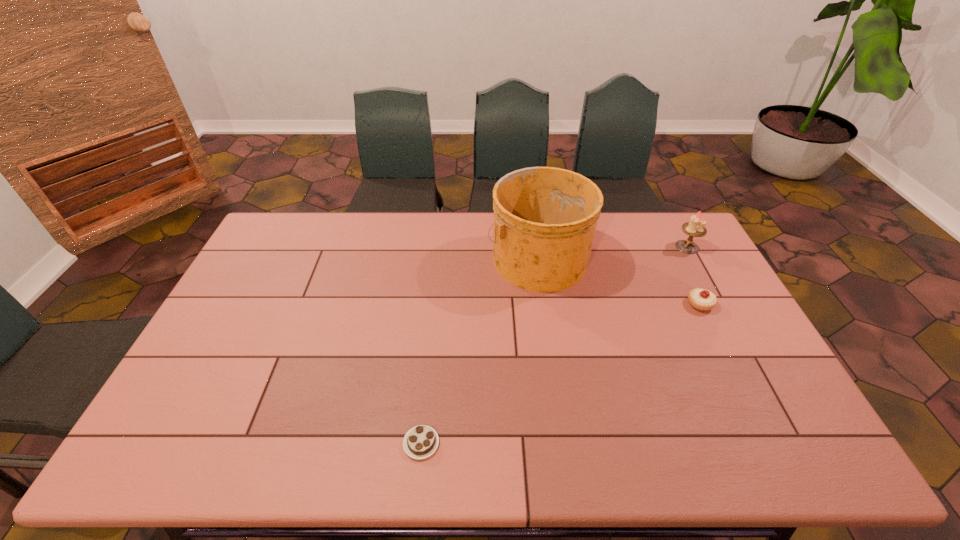
The image size is (960, 540). What are the coordinates of `free space that is in between the tallest object and the third tallest object` in the screenshot? It's located at pos(619,281).

This screenshot has width=960, height=540. I want to click on vacant region between the chocolate cake and the pastry, so click(x=561, y=374).

Where is `free point between the leftmost object and the second tallest object`? The height and width of the screenshot is (540, 960). free point between the leftmost object and the second tallest object is located at coordinates (554, 345).

This screenshot has width=960, height=540. Identify the location of vacant point located between the chocolate cake and the second shortest object. (561, 374).

In order to click on object that stands as the third closest to the tallest object in this screenshot , I will do `click(420, 442)`.

Locate an element on the screen. the second closest object to the candle holder is located at coordinates (545, 218).

You are a GUI agent. You are given a task and a screenshot of the screen. Output one action in this format:
    pyautogui.click(x=<x>, y=<y>)
    Task: Click on the blank space that satisfies the following two spatial constraints: 1. on the front side of the second object from left to right; 2. on the right side of the pastry
    
    Given the screenshot: What is the action you would take?
    pyautogui.click(x=544, y=304)